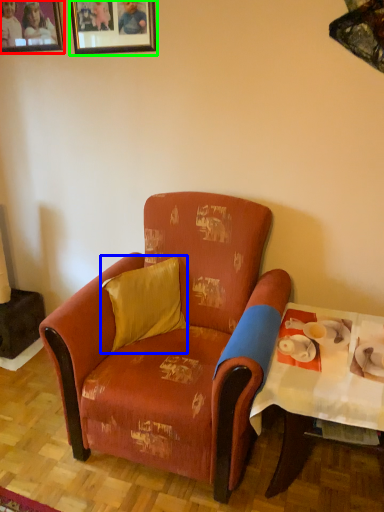
Question: Which object is the farthest from picture frame (highlighted by a red box)? Choose among these: pillow (highlighted by a blue box) or picture frame (highlighted by a green box).

Choices:
 (A) pillow
 (B) picture frame

Answer: (A)